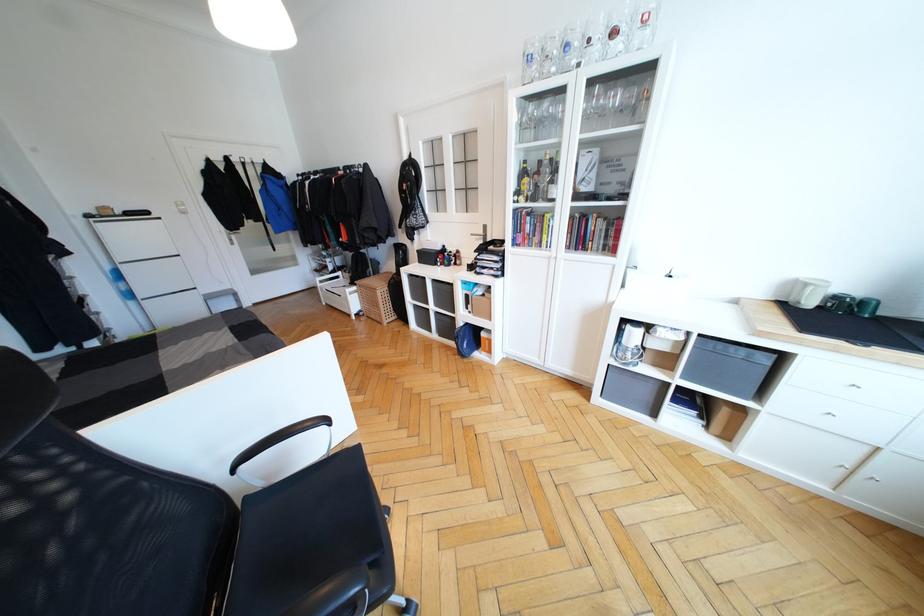
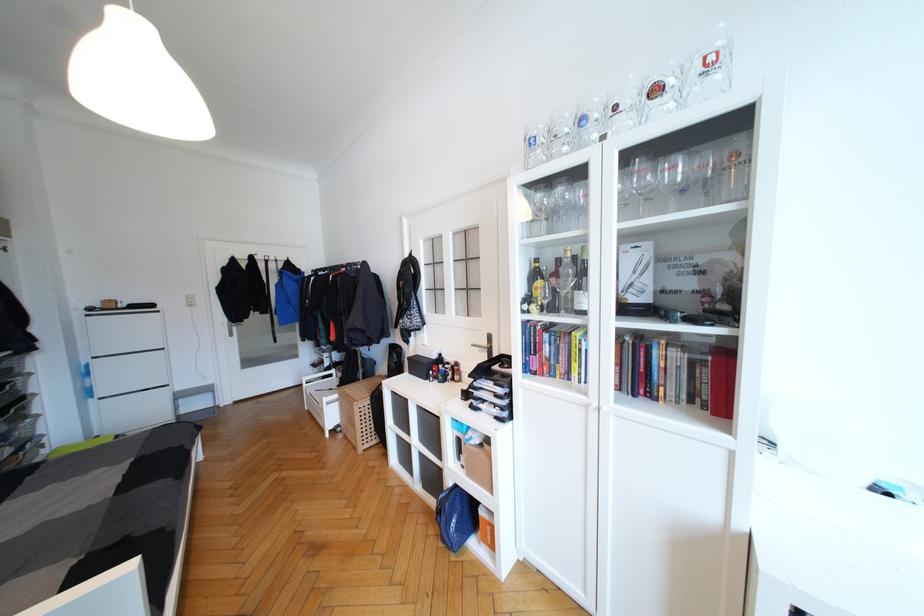
In the second image, find the point that corresponds to pixel 564 123 in the first image.

(587, 212)